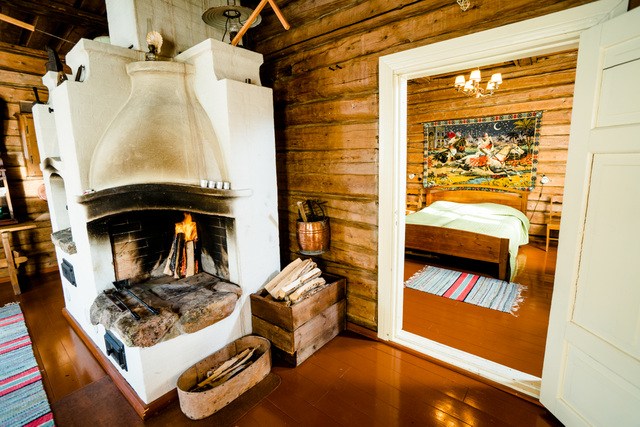
What are the coordinates of `soot covered wall` in the screenshot? It's located at (144, 242).